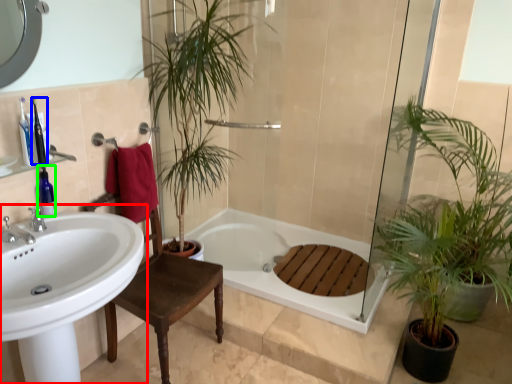
Question: Based on their relative distances, which object is nearer to sink (highlighted by a red box)? Choose from toiletry (highlighted by a blue box) and toiletry (highlighted by a green box).

Choices:
 (A) toiletry
 (B) toiletry

Answer: (B)